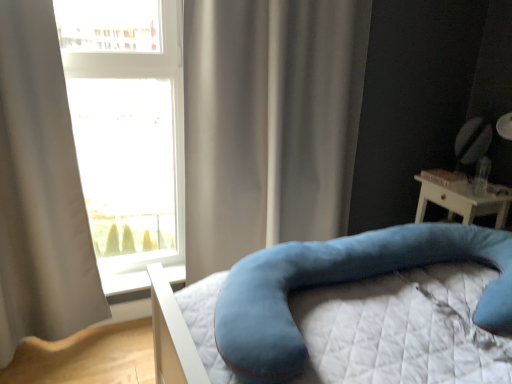
Question: Considering the positions of point (71, 271) and point (394, 264), is point (71, 271) closer or farther from the camera than point (394, 264)?

Choices:
 (A) farther
 (B) closer

Answer: (A)

Question: Relative to velvety blue pillow at lower right, is light gray fabric curtain at left, which appears as the first curtain when viewed from the left, in front or behind?

Choices:
 (A) behind
 (B) front

Answer: (A)

Question: Estimate the real-world distances between objects in this image. Which object is closer to the light gray fabric curtain at left, which appears as the first curtain when viewed from the left?

Choices:
 (A) velvety blue pillow at lower right
 (B) transparent glass window at upper left
 (C) satin beige curtain at center, which ranks as the first curtain in right-to-left order
 (D) white plastic window sill at lower left

Answer: (D)

Question: Estimate the real-world distances between objects in this image. Which object is farther from the transparent glass window at upper left?

Choices:
 (A) light gray fabric curtain at left, which appears as the first curtain when viewed from the left
 (B) white plastic window sill at lower left
 (C) satin beige curtain at center, which ranks as the first curtain in right-to-left order
 (D) velvety blue pillow at lower right

Answer: (D)